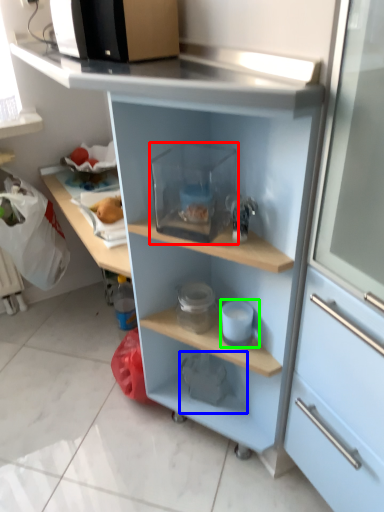
Question: Considering the real-world distances, which object is closest to appliance (highlighted by a red box)? appliance (highlighted by a blue box) or appliance (highlighted by a green box).

Choices:
 (A) appliance
 (B) appliance

Answer: (B)